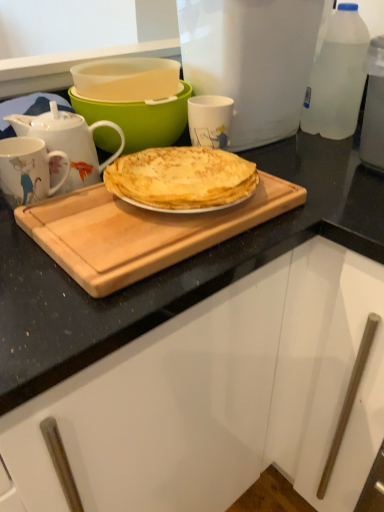
At what (x,y) coordinates should I click in order to perform the action: click on clear plastic bottle at upper right. Please return your answer as a coordinate pair (x, y). This screenshot has width=384, height=512. Looking at the image, I should click on (337, 75).

What do you see at coordinates (251, 61) in the screenshot? I see `white plastic container at upper center` at bounding box center [251, 61].

Measure the distance between point (110, 162) and camera.

The depth of point (110, 162) is 31.73 inches.

At what (x,y) coordinates should I click in order to perform the action: click on matte green bowl at upper center. Please return your answer as a coordinate pair (x, y). The height and width of the screenshot is (512, 384). Looking at the image, I should click on (140, 118).

From the image's perspective, which object appears higher, white glossy teapot at upper left or white glossy mug at upper center, the 2th coffee cup in the front-to-back sequence?

From the image's view, white glossy mug at upper center, the 2th coffee cup in the front-to-back sequence, is above.

Considering the relative sizes of white glossy teapot at upper left and white glossy mug at upper center, which is counted as the 1th coffee cup, starting from the right, in the image provided, is white glossy teapot at upper left taller than white glossy mug at upper center, which is counted as the 1th coffee cup, starting from the right,?

Correct, white glossy teapot at upper left is much taller as white glossy mug at upper center, which is counted as the 1th coffee cup, starting from the right.

Consider the image. From a real-world perspective, is white glossy teapot at upper left under white glossy mug at upper center, which appears as the second coffee cup when viewed from the left?

No, from a real-world perspective, white glossy teapot at upper left is not beneath white glossy mug at upper center, which appears as the second coffee cup when viewed from the left.

Which object is further away from the camera, porcelain floral mug at left, positioned as the first coffee cup in front-to-back order, or wooden cutting board at center?

Positioned behind is porcelain floral mug at left, positioned as the first coffee cup in front-to-back order.

Considering the positions of points (24, 152) and (132, 212), is point (24, 152) farther from camera compared to point (132, 212)?

That is True.

From the image's perspective, is porcelain floral mug at left, marked as the 1th coffee cup in a bottom-to-top arrangement, located above or below wooden cutting board at center?

porcelain floral mug at left, marked as the 1th coffee cup in a bottom-to-top arrangement, is above wooden cutting board at center.

Is porcelain floral mug at left, the second coffee cup when ordered from back to front, turned away from wooden cutting board at center?

porcelain floral mug at left, the second coffee cup when ordered from back to front, does not have its back to wooden cutting board at center.

Based on the photo, between wooden cutting board at center and white glossy mug at upper center, the first coffee cup in the top-to-bottom sequence, which one has smaller size?

With smaller size is white glossy mug at upper center, the first coffee cup in the top-to-bottom sequence.

From the image's perspective, who appears lower, wooden cutting board at center or white glossy mug at upper center, the 2th coffee cup in the front-to-back sequence?

wooden cutting board at center.

Is wooden cutting board at center touching white glossy mug at upper center, which appears as the second coffee cup when viewed from the left?

No.

From a real-world perspective, is porcelain floral mug at left, the second coffee cup from the right, above or below clear plastic bottle at upper right?

porcelain floral mug at left, the second coffee cup from the right, is situated lower than clear plastic bottle at upper right in the real world.

Where is `coffee cup that is the 2nd object located in front of the clear plastic bottle at upper right`? Image resolution: width=384 pixels, height=512 pixels. coffee cup that is the 2nd object located in front of the clear plastic bottle at upper right is located at coordinates (27, 170).

Is point (37, 178) farther from camera compared to point (325, 114)?

No, it is in front of (325, 114).

How much distance is there between white glossy teapot at upper left and clear plastic bottle at upper right?

white glossy teapot at upper left is 19.80 inches from clear plastic bottle at upper right.

Which object is further away from the camera taking this photo, white glossy teapot at upper left or clear plastic bottle at upper right?

clear plastic bottle at upper right is more distant.

How different are the orientations of white glossy teapot at upper left and clear plastic bottle at upper right in degrees?

The angular difference between white glossy teapot at upper left and clear plastic bottle at upper right is 87.7 degrees.

Considering the sizes of white glossy teapot at upper left and clear plastic bottle at upper right in the image, is white glossy teapot at upper left taller or shorter than clear plastic bottle at upper right?

white glossy teapot at upper left is shorter than clear plastic bottle at upper right.

Is white plastic container at upper center surrounded by white glossy mug at upper center, which appears as the second coffee cup when viewed from the left?

No, white plastic container at upper center is not a part of white glossy mug at upper center, which appears as the second coffee cup when viewed from the left.

Is there a large distance between white glossy mug at upper center, which is counted as the 1th coffee cup, starting from the right, and white plastic container at upper center?

Actually, white glossy mug at upper center, which is counted as the 1th coffee cup, starting from the right, and white plastic container at upper center are a little close together.

Does white glossy mug at upper center, the 2th coffee cup in the front-to-back sequence, turn towards white plastic container at upper center?

No, white glossy mug at upper center, the 2th coffee cup in the front-to-back sequence, is not facing towards white plastic container at upper center.

Is white glossy mug at upper center, the 2th coffee cup in the front-to-back sequence, shorter than white plastic container at upper center?

Yes.

Can you see wooden cutting board at center touching porcelain floral mug at left, marked as the 1th coffee cup in a bottom-to-top arrangement?

wooden cutting board at center and porcelain floral mug at left, marked as the 1th coffee cup in a bottom-to-top arrangement, are clearly separated.

Which object is positioned more to the left, wooden cutting board at center or porcelain floral mug at left, positioned as the first coffee cup in front-to-back order?

Positioned to the left is porcelain floral mug at left, positioned as the first coffee cup in front-to-back order.

Is wooden cutting board at center not inside porcelain floral mug at left, positioned as the first coffee cup in front-to-back order?

wooden cutting board at center is positioned outside porcelain floral mug at left, positioned as the first coffee cup in front-to-back order.

Consider the image. Which is nearer, (124, 217) or (1, 142)?

Point (124, 217) is closer to the camera than point (1, 142).

I want to click on coffee cup behind the white glossy teapot at upper left, so click(209, 120).

There is a wooden cutting board at center. Where is `the 1st coffee cup above it (from a real-world perspective)`? The image size is (384, 512). the 1st coffee cup above it (from a real-world perspective) is located at coordinates (27, 170).

From the image, which object appears to be nearer to porcelain floral mug at left, which ranks as the 1th coffee cup in left-to-right order, matte green bowl at upper center or wooden cutting board at center?

wooden cutting board at center is positioned closer to the anchor porcelain floral mug at left, which ranks as the 1th coffee cup in left-to-right order.

When comparing their distances from wooden cutting board at center, does porcelain floral mug at left, positioned as the first coffee cup in front-to-back order, or white plastic container at upper center seem closer?

The object closer to wooden cutting board at center is porcelain floral mug at left, positioned as the first coffee cup in front-to-back order.

Based on their spatial positions, is white glossy teapot at upper left or porcelain floral mug at left, positioned as the first coffee cup in front-to-back order, further from clear plastic bottle at upper right?

Among the two, porcelain floral mug at left, positioned as the first coffee cup in front-to-back order, is located further to clear plastic bottle at upper right.

Estimate the real-world distances between objects in this image. Which object is further from matte green bowl at upper center, white plastic container at upper center or white glossy mug at upper center, placed as the first coffee cup when sorted from back to front?

white plastic container at upper center.

When comparing their distances from white glossy teapot at upper left, does porcelain floral mug at left, marked as the 1th coffee cup in a bottom-to-top arrangement, or clear plastic bottle at upper right seem further?

The object further to white glossy teapot at upper left is clear plastic bottle at upper right.

When comparing their distances from wooden cutting board at center, does white glossy teapot at upper left or white glossy mug at upper center, which is counted as the 1th coffee cup, starting from the right, seem closer?

Among the two, white glossy teapot at upper left is located nearer to wooden cutting board at center.

From the image, which object appears to be farther from white plastic container at upper center, white glossy mug at upper center, arranged as the second coffee cup when ordered from the bottom, or clear plastic bottle at upper right?

Answer: The object further to white plastic container at upper center is white glossy mug at upper center, arranged as the second coffee cup when ordered from the bottom.

From the image, which object appears to be farther from white glossy mug at upper center, placed as the first coffee cup when sorted from back to front, wooden cutting board at center or white plastic container at upper center?

wooden cutting board at center is further to white glossy mug at upper center, placed as the first coffee cup when sorted from back to front.

The image size is (384, 512). Find the location of `teapot between porcelain floral mug at left, the second coffee cup when ordered from back to front, and clear plastic bottle at upper right from left to right`. teapot between porcelain floral mug at left, the second coffee cup when ordered from back to front, and clear plastic bottle at upper right from left to right is located at coordinates tap(69, 142).

Identify the location of kitchen appliance between porcelain floral mug at left, the second coffee cup from the right, and clear plastic bottle at upper right. (251, 61).

Where is `bowl between wooden cutting board at center and white glossy mug at upper center, the first coffee cup in the top-to-bottom sequence, in the front-back direction`? bowl between wooden cutting board at center and white glossy mug at upper center, the first coffee cup in the top-to-bottom sequence, in the front-back direction is located at coordinates (140, 118).

You are a GUI agent. You are given a task and a screenshot of the screen. Output one action in this format:
    pyautogui.click(x=<x>, y=<y>)
    Task: Click on the coffee cup located between white glossy teapot at upper left and white plastic container at upper center in the left-right direction
    
    Given the screenshot: What is the action you would take?
    pyautogui.click(x=209, y=120)